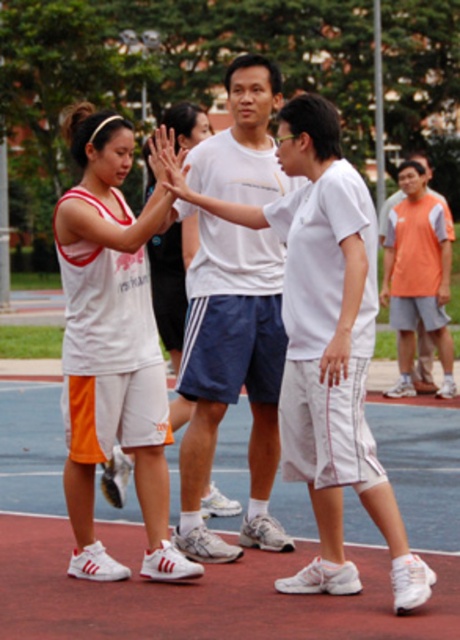
Question: Which point is closer to the camera taking this photo?

Choices:
 (A) (131, 316)
 (B) (277, 380)
 (C) (427, 476)

Answer: (A)

Question: Among these points, which one is nearest to the camera?

Choices:
 (A) (161, 520)
 (B) (231, 556)

Answer: (A)

Question: Is white matte shorts at center to the right of orange fabric shirt at upper right from the viewer's perspective?

Choices:
 (A) yes
 (B) no

Answer: (B)

Question: Considering the real-world distances, which object is closest to the white matte shorts at center?

Choices:
 (A) orange fabric shirt at upper right
 (B) white matte t-shirt at center

Answer: (B)

Question: Does white matte shorts at center lie in front of white matte t-shirt at center?

Choices:
 (A) no
 (B) yes

Answer: (B)

Question: Does white synthetic court at center come behind white matte t-shirt at center?

Choices:
 (A) yes
 (B) no

Answer: (B)